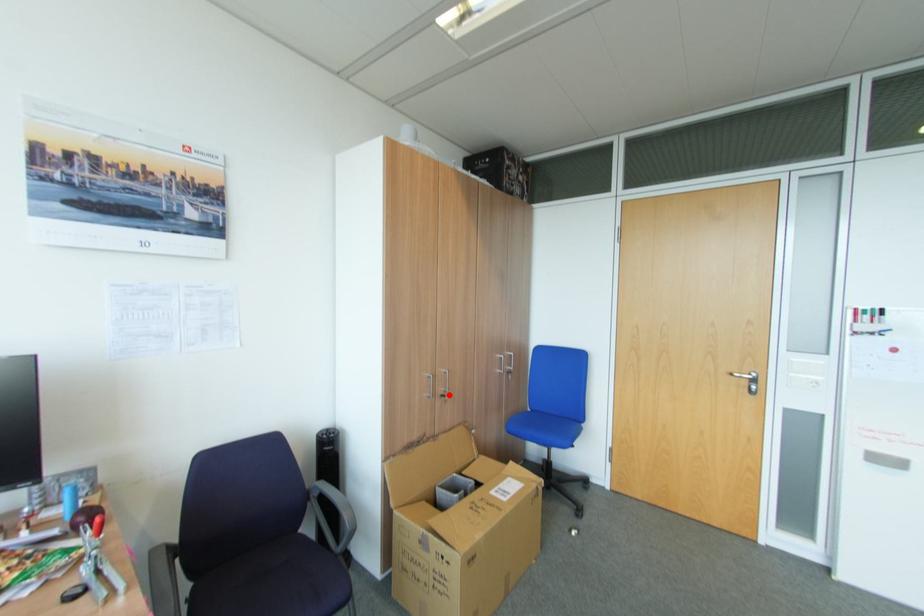
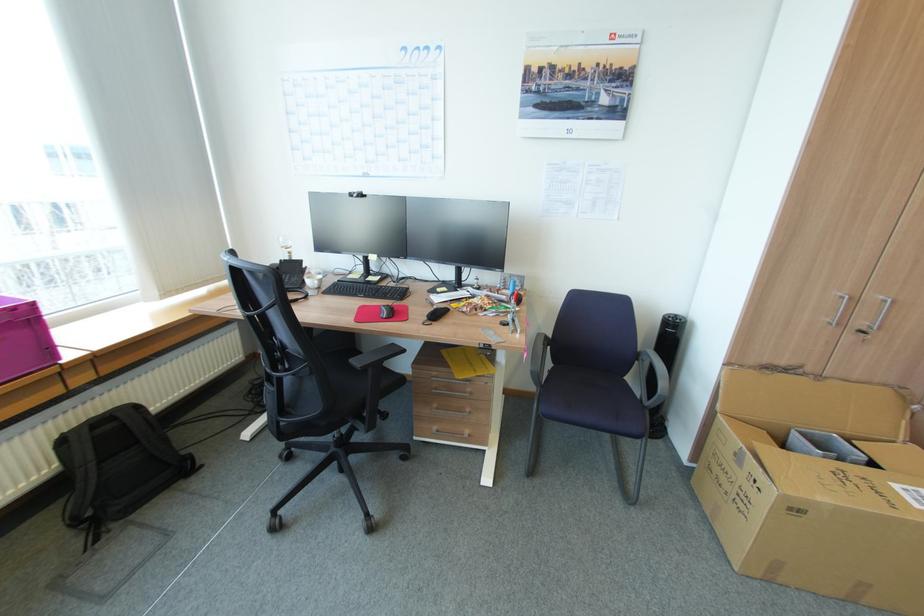
Question: I am providing you with two images of the same scene from different viewpoints. Image1 has a red point marked. In image2, the corresponding 3D location appears at what relative position? Reply with the corresponding letter.

Choices:
 (A) Closer
 (B) Farther

Answer: (A)